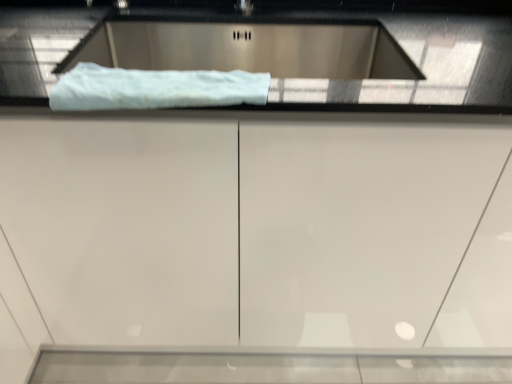
Question: From a real-world perspective, relative to satin silver sink at upper center, is white fluffy towel at upper center vertically above or below?

Choices:
 (A) above
 (B) below

Answer: (A)

Question: Would you say white fluffy towel at upper center is inside or outside satin silver sink at upper center?

Choices:
 (A) inside
 (B) outside

Answer: (B)

Question: Which of these objects is positioned closest to the white fluffy towel at upper center?

Choices:
 (A) white glossy cabinet at center
 (B) satin silver sink at upper center

Answer: (A)

Question: Considering the real-world distances, which object is farthest from the white glossy cabinet at center?

Choices:
 (A) satin silver sink at upper center
 (B) white fluffy towel at upper center

Answer: (A)